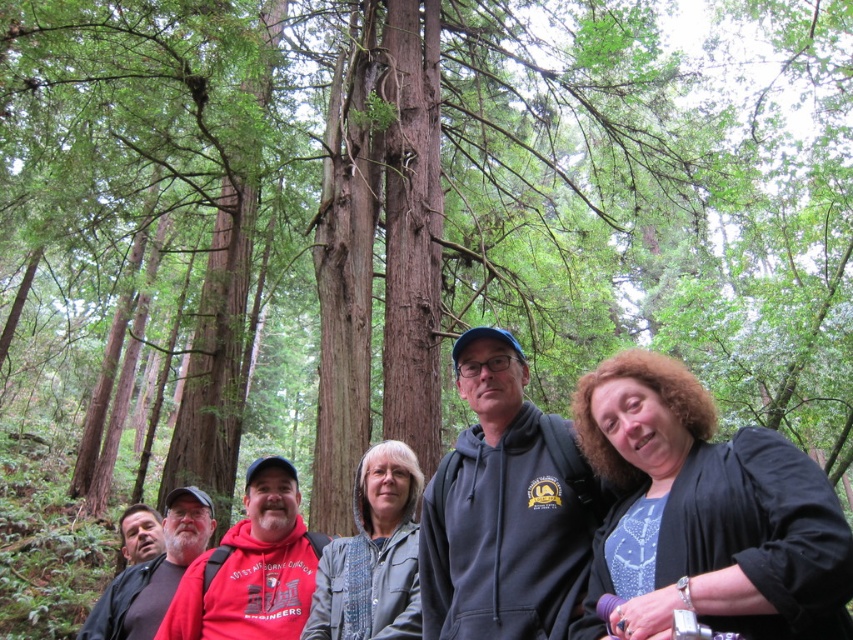
Question: In this image, where is black matte jacket at lower right located relative to dark gray hoodie at center?

Choices:
 (A) below
 (B) above

Answer: (B)

Question: Considering the relative positions of gray textured jacket at center and red hoodie at left in the image provided, where is gray textured jacket at center located with respect to red hoodie at left?

Choices:
 (A) above
 (B) below

Answer: (A)

Question: Among these points, which one is nearest to the camera?

Choices:
 (A) (468, 621)
 (B) (846, 598)

Answer: (B)

Question: Which object appears closest to the camera in this image?

Choices:
 (A) black matte jacket at lower right
 (B) dark gray hoodie at center
 (C) red hoodie at left

Answer: (A)

Question: Which point is closer to the camera taking this photo?

Choices:
 (A) (369, 488)
 (B) (509, 381)
 (C) (276, 556)
 (D) (686, 547)

Answer: (D)

Question: Is dark gray hoodie at center to the left of red hoodie at left from the viewer's perspective?

Choices:
 (A) no
 (B) yes

Answer: (A)